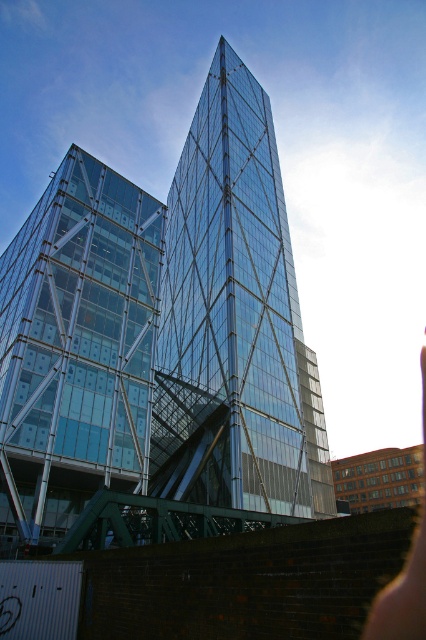
Question: Is transparent glass tower at center bigger than pink skin at lower right?

Choices:
 (A) no
 (B) yes

Answer: (A)

Question: Which object appears closest to the camera in this image?

Choices:
 (A) pink skin at lower right
 (B) transparent glass building at left
 (C) skinny pinkish skin at lower right
 (D) transparent glass tower at center

Answer: (C)

Question: Can you confirm if transparent glass building at left is positioned above skinny pinkish skin at lower right?

Choices:
 (A) yes
 (B) no

Answer: (A)

Question: Is transparent glass building at left closer to camera compared to skinny pinkish skin at lower right?

Choices:
 (A) no
 (B) yes

Answer: (A)

Question: Which of these objects is positioned closest to the skinny pinkish skin at lower right?

Choices:
 (A) pink skin at lower right
 (B) transparent glass tower at center

Answer: (A)

Question: Which point is closer to the camera?

Choices:
 (A) (x=103, y=371)
 (B) (x=405, y=636)

Answer: (B)